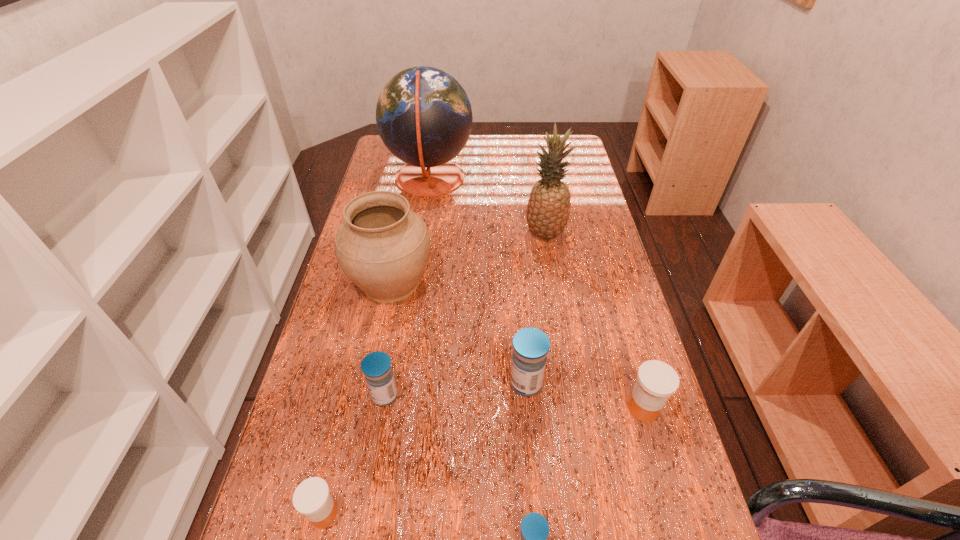
The width and height of the screenshot is (960, 540). What are the coordinates of `free spot between the second farthest object and the rightmost object` in the screenshot? It's located at (594, 321).

The image size is (960, 540). Find the location of `free space between the rightmost object and the seventh nearest object`. free space between the rightmost object and the seventh nearest object is located at coordinates coord(594,321).

The height and width of the screenshot is (540, 960). I want to click on unoccupied area between the seventh nearest object and the third tallest object, so click(x=468, y=258).

At what (x,y) coordinates should I click in order to perform the action: click on vacant area that lies between the rightmost medicine and the biggest blue medicine. Please return your answer as a coordinate pair (x, y). The height and width of the screenshot is (540, 960). Looking at the image, I should click on (585, 396).

Locate an element on the screen. The width and height of the screenshot is (960, 540). the seventh closest object to the left orange medicine is located at coordinates (424, 117).

Image resolution: width=960 pixels, height=540 pixels. Find the location of `object that is the fifth closest to the urn`. object that is the fifth closest to the urn is located at coordinates (312, 498).

Locate an element on the screen. The width and height of the screenshot is (960, 540). medicine identified as the fourth closest to the farther orange medicine is located at coordinates (312, 498).

Locate an element on the screen. The width and height of the screenshot is (960, 540). medicine that can be found as the closest to the smaller orange medicine is located at coordinates (376, 366).

Locate an element on the screen. the closest blue medicine to the farthest object is located at coordinates (530, 345).

Where is `the closest blue medicine to the farthest object`? The height and width of the screenshot is (540, 960). the closest blue medicine to the farthest object is located at coordinates (530, 345).